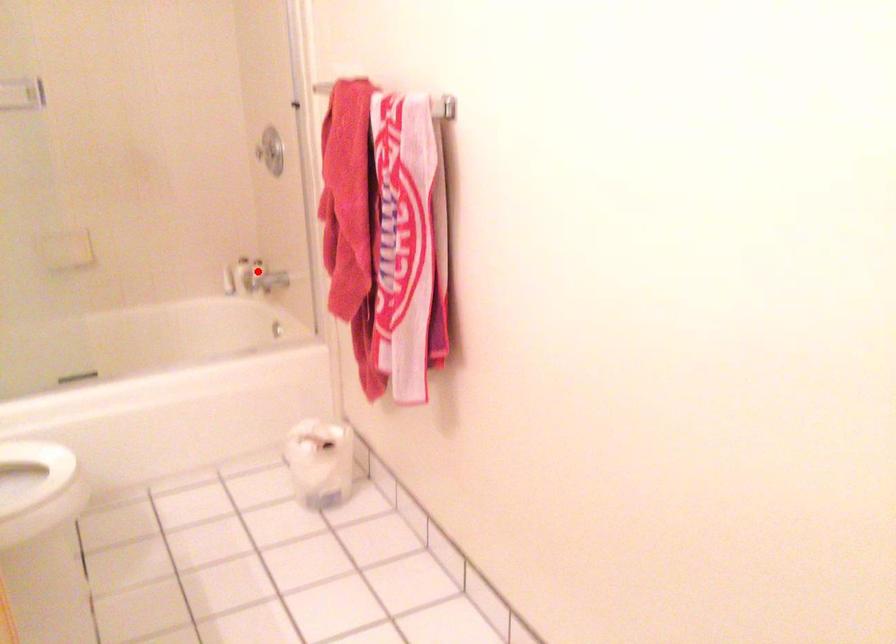
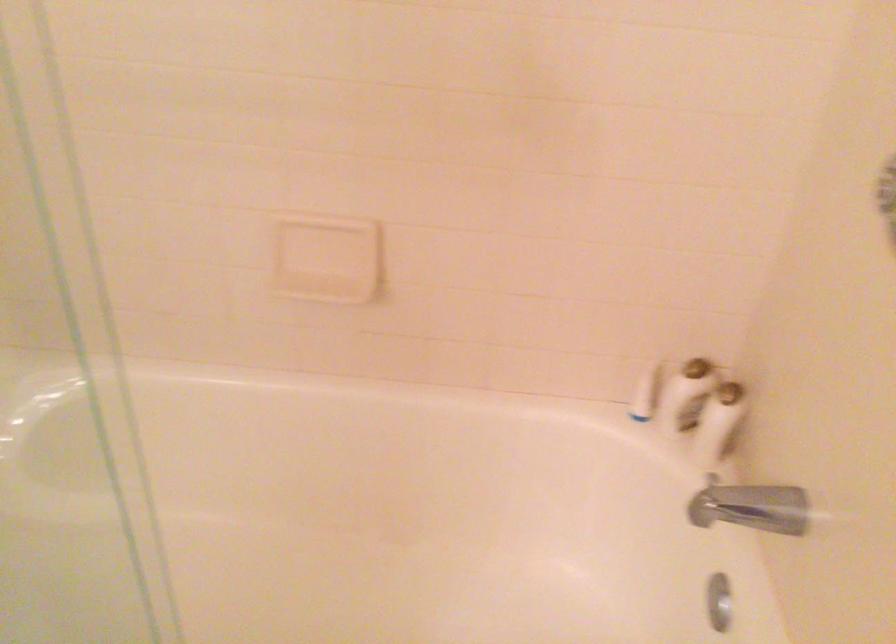
Question: I am providing you with two images of the same scene from different viewpoints. A red point is marked on the first image. At the location where the point appears in image 1, is it still visible in image 2?

Choices:
 (A) Yes
 (B) No

Answer: (A)